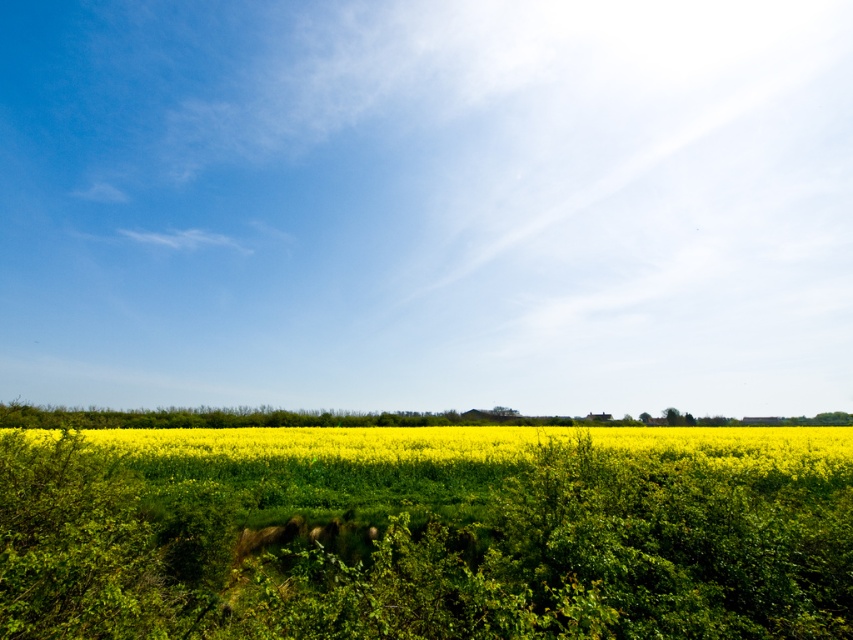
Question: Which object appears closest to the camera in this image?

Choices:
 (A) blue sky at upper center
 (B) yellow matte flower at center

Answer: (B)

Question: Is blue sky at upper center to the right of yellow matte flower at center from the viewer's perspective?

Choices:
 (A) yes
 (B) no

Answer: (B)

Question: Does blue sky at upper center appear over yellow matte flower at center?

Choices:
 (A) yes
 (B) no

Answer: (A)

Question: From the image, what is the correct spatial relationship of blue sky at upper center in relation to yellow matte flower at center?

Choices:
 (A) right
 (B) left

Answer: (B)